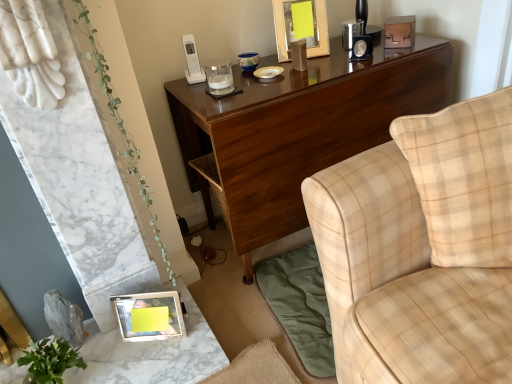
The width and height of the screenshot is (512, 384). What are the coordinates of `free point to the right of metallic silver photo frame at lower left, positioned as the second picture frame in top-to-bottom order` in the screenshot? It's located at (197, 331).